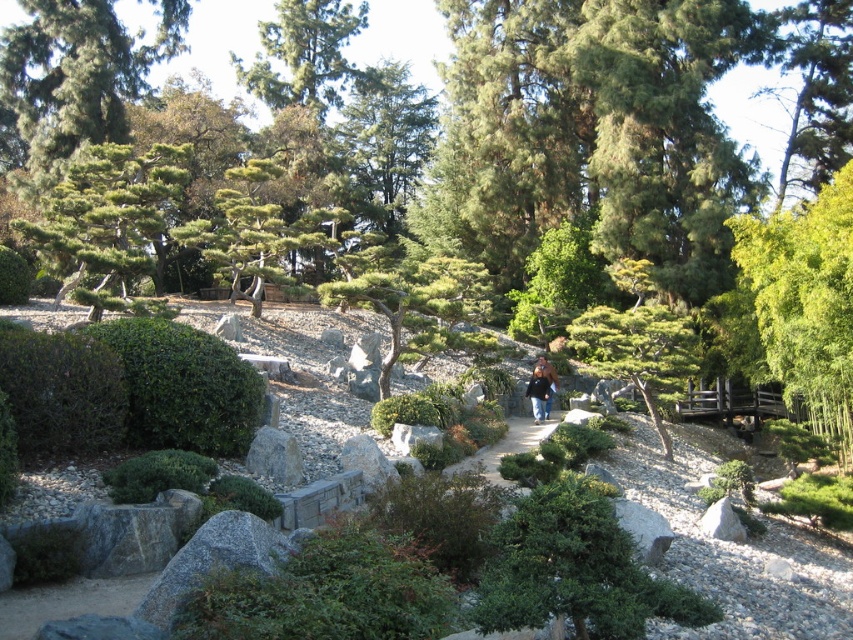
Is green matte bush at center above green textured tree at center?

Actually, green matte bush at center is below green textured tree at center.

What do you see at coordinates (575, 570) in the screenshot? I see `green matte bush at center` at bounding box center [575, 570].

In order to click on green matte bush at center in this screenshot , I will do `click(575, 570)`.

Describe the element at coordinates (61, 392) in the screenshot. I see `green leafy bush at lower left` at that location.

Is green leafy bush at lower left above green textured tree at center?

Incorrect, green leafy bush at lower left is not positioned above green textured tree at center.

Who is more forward, (26, 364) or (358, 294)?

Point (26, 364) is in front.

Locate an element on the screen. green leafy bush at lower left is located at coordinates (61, 392).

Can you confirm if green matte bush at center is taller than gravel pathway at center?

Yes, green matte bush at center is taller than gravel pathway at center.

Is green matte bush at center in front of gravel pathway at center?

Yes, green matte bush at center is closer to the viewer.

This screenshot has width=853, height=640. Describe the element at coordinates (575, 570) in the screenshot. I see `green matte bush at center` at that location.

Image resolution: width=853 pixels, height=640 pixels. What are the coordinates of `green matte bush at center` in the screenshot? It's located at (575, 570).